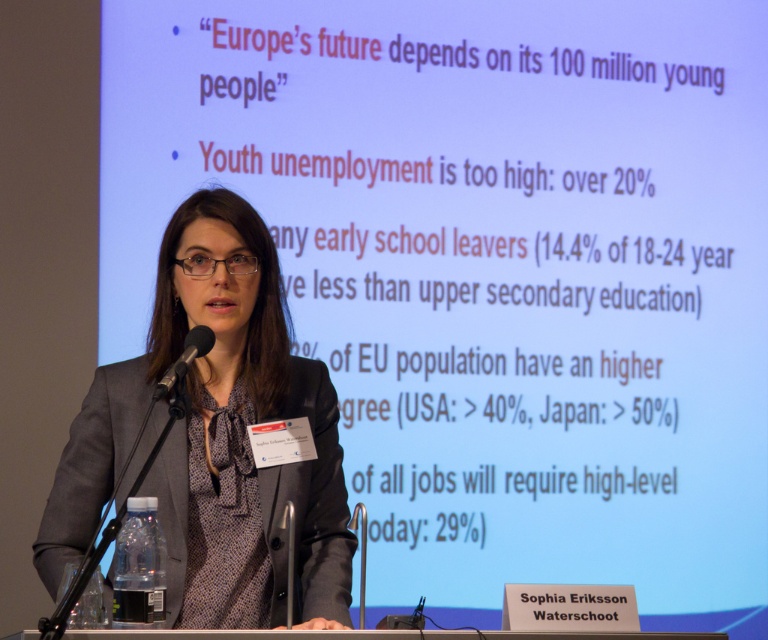
Is matte gray blazer at center taller than black matte microphone at left?

Yes.

Who is more forward, (296, 403) or (197, 324)?

Point (197, 324) is in front.

You are a GUI agent. You are given a task and a screenshot of the screen. Output one action in this format:
    pyautogui.click(x=<x>, y=<y>)
    Task: Click on the matte gray blazer at center
    The image size is (768, 640).
    Given the screenshot: What is the action you would take?
    (217, 440)